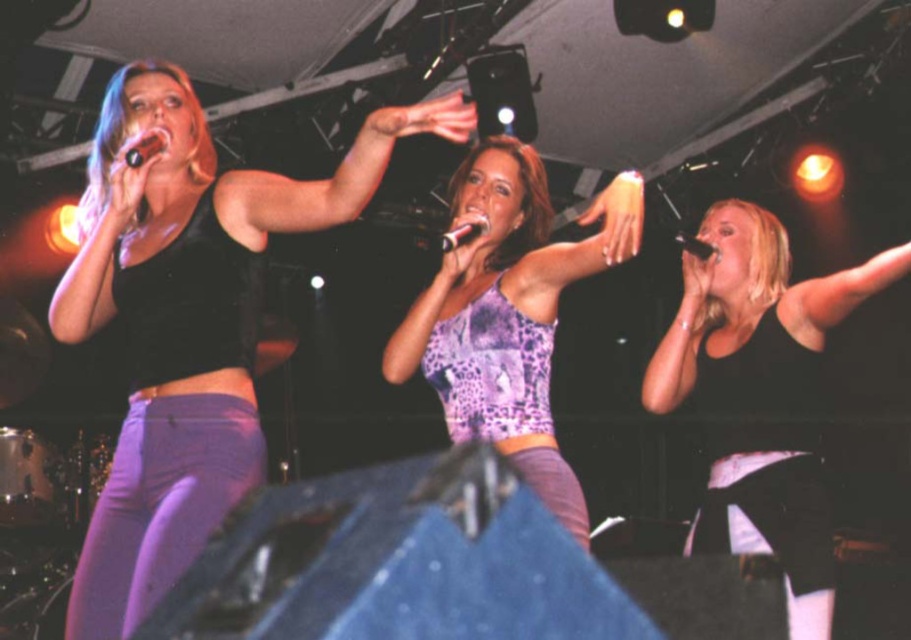
Question: Is black matte tank top at center to the right of black matte microphone at upper center from the viewer's perspective?

Choices:
 (A) yes
 (B) no

Answer: (A)

Question: Which is farther from the black plastic microphone at center?

Choices:
 (A) shiny black microphone at upper left
 (B) black matte microphone at upper center
 (C) black matte tank top at center

Answer: (C)

Question: Does black matte tank top at center have a smaller size compared to shiny black microphone at upper left?

Choices:
 (A) no
 (B) yes

Answer: (A)

Question: Which object is positioned farthest from the black matte tank top at left?

Choices:
 (A) shiny black microphone at upper left
 (B) black plastic microphone at center
 (C) black matte tank top at center

Answer: (C)

Question: Which of these objects is positioned closest to the black matte microphone at upper center?

Choices:
 (A) purple leopard print tank top at center
 (B) shiny black microphone at upper left
 (C) black matte tank top at left
 (D) black matte tank top at center

Answer: (D)

Question: Can you confirm if black matte tank top at center is positioned to the left of purple leopard print tank top at center?

Choices:
 (A) yes
 (B) no

Answer: (B)